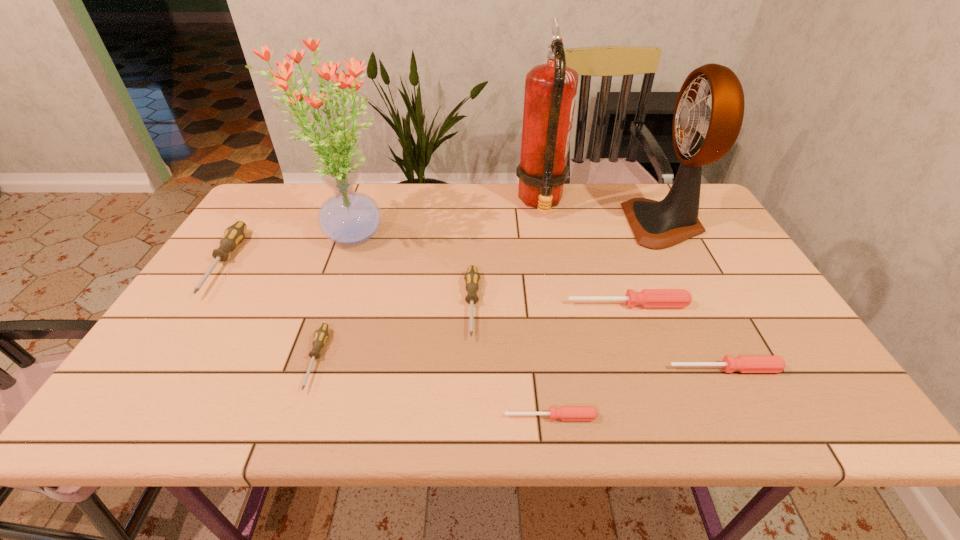
Where is `screwdriver at the right edge`? screwdriver at the right edge is located at coordinates [743, 363].

This screenshot has height=540, width=960. I want to click on object that is at the far right corner, so click(x=702, y=135).

This screenshot has height=540, width=960. In the image, there is a desktop. Identify the location of free space at the far edge. (594, 199).

Locate an element on the screen. This screenshot has height=540, width=960. vacant space at the near edge of the desktop is located at coordinates (209, 420).

Locate an element on the screen. The image size is (960, 540). free space at the left edge of the desktop is located at coordinates (151, 383).

This screenshot has width=960, height=540. I want to click on vacant space at the right edge of the desktop, so click(790, 364).

What are the coordinates of `vacant point at the far left corner` in the screenshot? It's located at (285, 182).

Locate an element on the screen. free spot between the smallest gray screwdriver and the second smallest gray screwdriver is located at coordinates (395, 332).

Where is `empty space between the farthest red screwdriver and the red fire extinguisher`? empty space between the farthest red screwdriver and the red fire extinguisher is located at coordinates (585, 253).

Where is `vacant area between the biggest red screwdriver and the flower arrangement`? The image size is (960, 540). vacant area between the biggest red screwdriver and the flower arrangement is located at coordinates (489, 269).